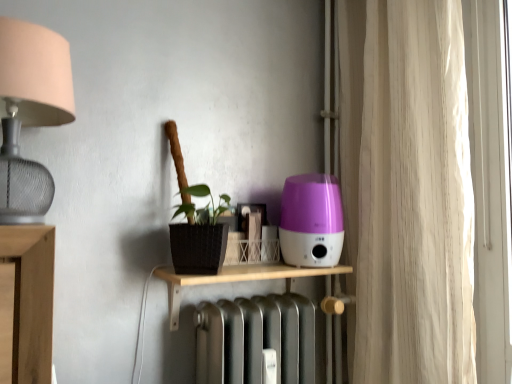
Question: Considering the relative sizes of wooden shelf at center and beige fabric curtain at right in the image provided, is wooden shelf at center thinner than beige fabric curtain at right?

Choices:
 (A) no
 (B) yes

Answer: (A)

Question: Is beige fabric curtain at right surrounded by wooden shelf at center?

Choices:
 (A) yes
 (B) no

Answer: (B)

Question: Is wooden shelf at center at the left side of beige fabric curtain at right?

Choices:
 (A) no
 (B) yes

Answer: (B)

Question: Is wooden shelf at center taller than beige fabric curtain at right?

Choices:
 (A) no
 (B) yes

Answer: (A)

Question: Is wooden shelf at center closer to the viewer compared to beige fabric curtain at right?

Choices:
 (A) no
 (B) yes

Answer: (A)

Question: Is the surface of wooden shelf at center in direct contact with beige fabric curtain at right?

Choices:
 (A) yes
 (B) no

Answer: (B)

Question: Is wooden shelf at center outside matte silver lampshade at left?

Choices:
 (A) no
 (B) yes

Answer: (B)

Question: Does wooden shelf at center have a lesser width compared to matte silver lampshade at left?

Choices:
 (A) no
 (B) yes

Answer: (B)

Question: Is wooden shelf at center in contact with matte silver lampshade at left?

Choices:
 (A) yes
 (B) no

Answer: (B)

Question: Can you confirm if wooden shelf at center is taller than matte silver lampshade at left?

Choices:
 (A) yes
 (B) no

Answer: (B)

Question: Is wooden shelf at center shorter than matte silver lampshade at left?

Choices:
 (A) no
 (B) yes

Answer: (B)

Question: Is wooden shelf at center closer to the viewer compared to matte silver lampshade at left?

Choices:
 (A) yes
 (B) no

Answer: (B)

Question: Considering the relative positions of purple glossy humidifier at center-right and beige fabric curtain at right in the image provided, is purple glossy humidifier at center-right to the right of beige fabric curtain at right from the viewer's perspective?

Choices:
 (A) yes
 (B) no

Answer: (B)